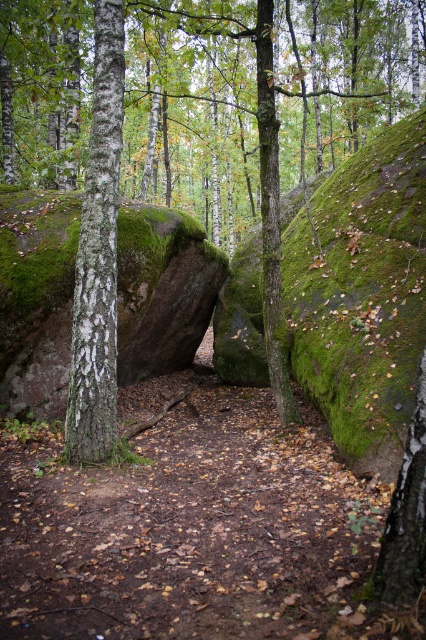
Can you confirm if green bark tree at center is positioned above green mossy tree trunk at center?

Correct, green bark tree at center is located above green mossy tree trunk at center.

You are a GUI agent. You are given a task and a screenshot of the screen. Output one action in this format:
    pyautogui.click(x=<x>, y=<y>)
    Task: Click on the green bark tree at center
    
    Given the screenshot: What is the action you would take?
    pyautogui.click(x=192, y=112)

Does green bark tree at center lie behind white bark tree trunk at center?

Yes.

Can you confirm if green bark tree at center is positioned below white bark tree trunk at center?

Incorrect, green bark tree at center is not positioned below white bark tree trunk at center.

Measure the distance between point (x=14, y=102) and camera.

Point (x=14, y=102) and camera are 13.75 meters apart.

At what (x,y) coordinates should I click in order to perform the action: click on green bark tree at center. Please return your answer as a coordinate pair (x, y). Looking at the image, I should click on (192, 112).

Find the location of `white bark tree trunk at center`. white bark tree trunk at center is located at coordinates (97, 253).

Which is behind, point (98, 224) or point (262, 92)?

The point (262, 92) is behind.

Identify the location of white bark tree trunk at center. The height and width of the screenshot is (640, 426). (97, 253).